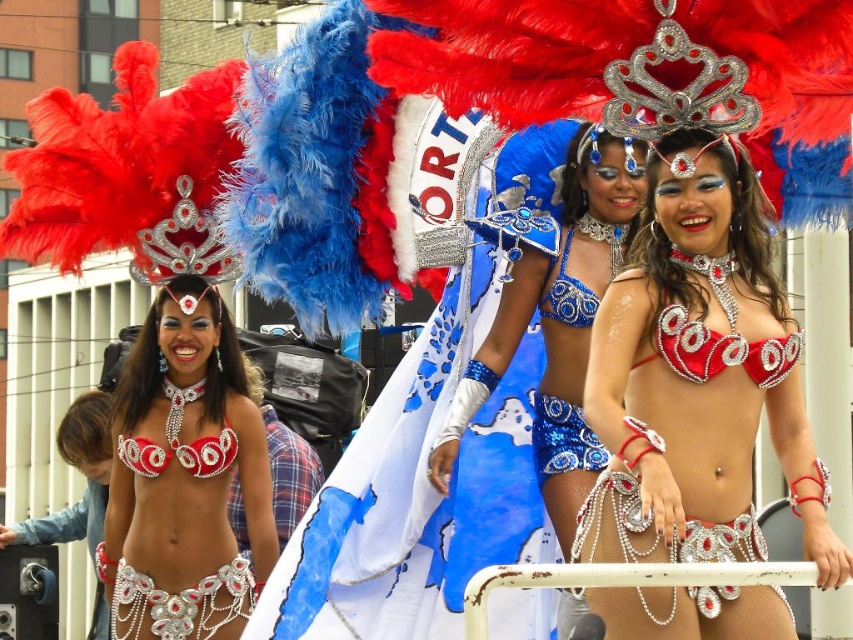
Question: Is shiny blue bikini top at center to the left of shiny blue sequins bikini top at center from the viewer's perspective?

Choices:
 (A) no
 (B) yes

Answer: (B)

Question: Which point is farther to the camera?

Choices:
 (A) shiny red bikini at center
 (B) shiny blue bikini top at center
 (C) shiny blue sequins bikini top at center

Answer: (C)

Question: Is shiny blue bikini top at center below shiny blue sequins bikini top at center?

Choices:
 (A) no
 (B) yes

Answer: (A)

Question: Can you confirm if shiny red bikini at center is positioned above shiny blue sequins bikini top at center?

Choices:
 (A) yes
 (B) no

Answer: (B)

Question: Which point appears farthest from the camera in this image?

Choices:
 (A) (695, 260)
 (B) (264, 474)
 (C) (544, 282)

Answer: (B)

Question: Which is farther from the shiny blue bikini top at center?

Choices:
 (A) matte silver bikini top at left
 (B) shiny blue sequins bikini top at center

Answer: (A)